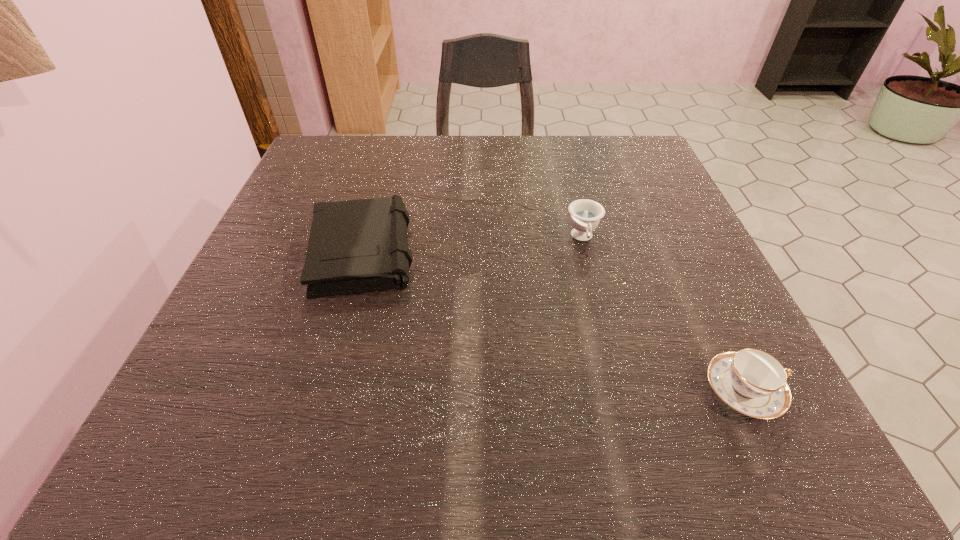
Identify the location of the farther teacup. This screenshot has width=960, height=540. (585, 215).

Identify the location of the second object from left to right. Image resolution: width=960 pixels, height=540 pixels. (585, 215).

What are the coordinates of `the leftmost object` in the screenshot? It's located at (358, 246).

Locate an element on the screen. the rightmost object is located at coordinates (751, 381).

Locate an element on the screen. the right teacup is located at coordinates (751, 381).

Where is `free space located 0.340m on the side of the second object from left to right with the handle`? free space located 0.340m on the side of the second object from left to right with the handle is located at coordinates (631, 427).

At what (x,y) coordinates should I click in order to perform the action: click on vacant space situated 0.290m on the back of the Bible. Please return your answer as a coordinate pair (x, y). The height and width of the screenshot is (540, 960). Looking at the image, I should click on (395, 139).

This screenshot has height=540, width=960. In order to click on object present at the near edge in this screenshot , I will do `click(751, 381)`.

Locate an element on the screen. Image resolution: width=960 pixels, height=540 pixels. object at the left edge is located at coordinates (358, 246).

The width and height of the screenshot is (960, 540). I want to click on object that is at the right edge, so click(751, 381).